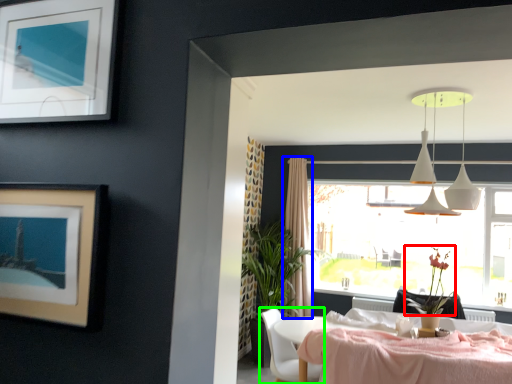
Question: Which object is positioned closest to flower (highlighted by a red box)? Select from curtain (highlighted by a blue box) and chair (highlighted by a green box).

Choices:
 (A) curtain
 (B) chair

Answer: (B)